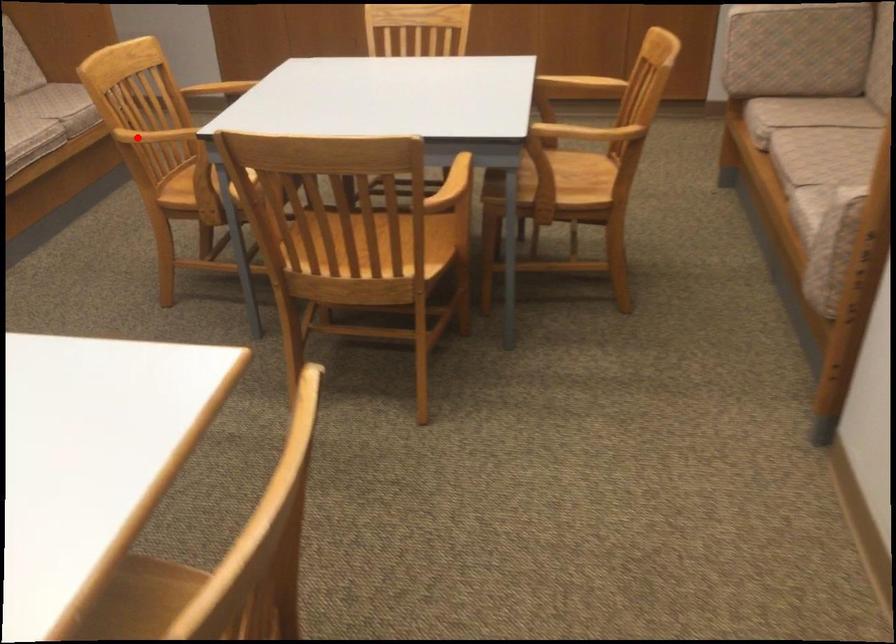
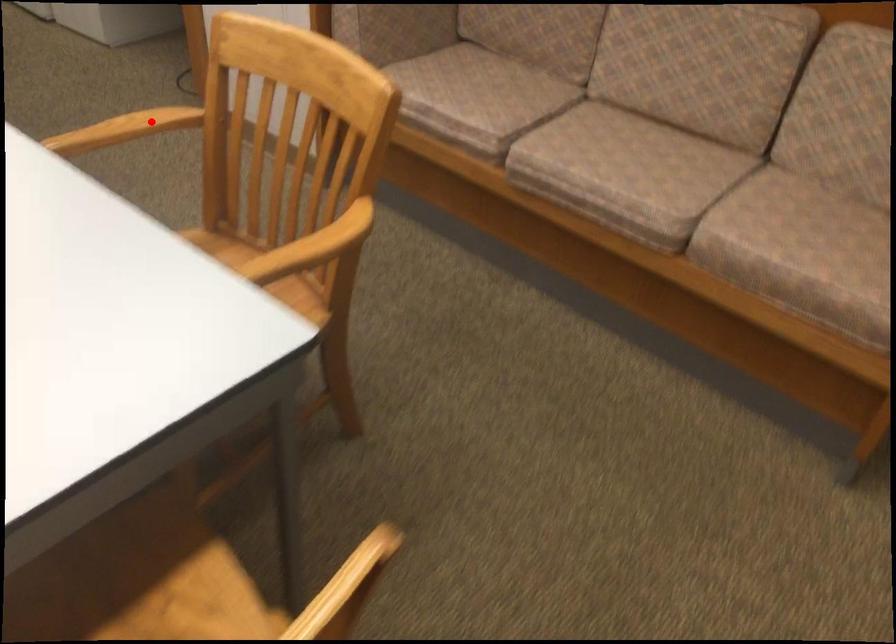
I am providing you with two images of the same scene from different viewpoints. A red point is marked on the first image and another point is marked on the second image. Do the highlighted points in image1 and image2 indicate the same real-world spot?

Yes